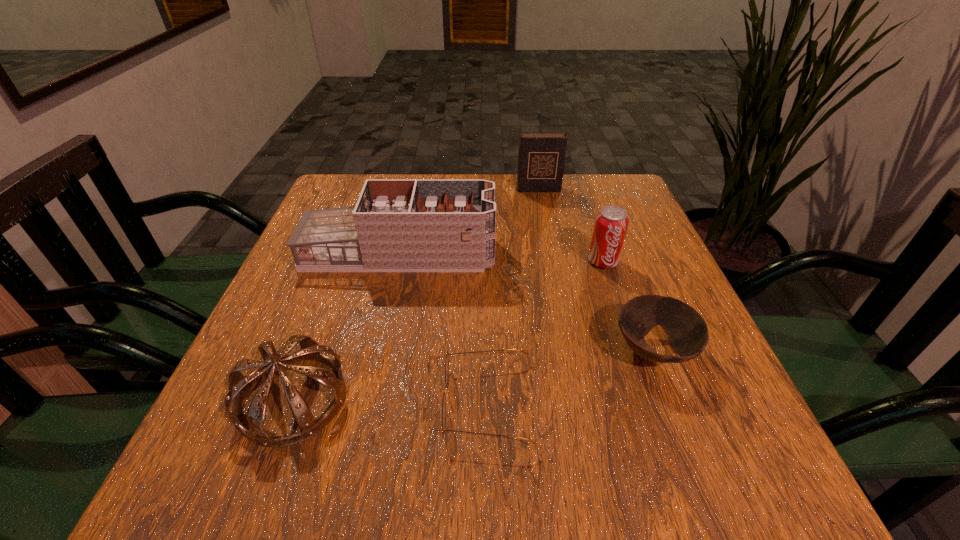
Image resolution: width=960 pixels, height=540 pixels. Identify the location of the third object from right to left. (541, 159).

Where is `the farthest object`? The image size is (960, 540). the farthest object is located at coordinates (541, 159).

Find the location of `dollhouse`. dollhouse is located at coordinates (405, 225).

At what (x,y) coordinates should I click in order to perform the action: click on soda can. Please return your answer as a coordinate pair (x, y). This screenshot has width=960, height=540. Looking at the image, I should click on (611, 223).

Locate an element on the screen. The height and width of the screenshot is (540, 960). tiara is located at coordinates (238, 384).

The height and width of the screenshot is (540, 960). In order to click on bowl in this screenshot , I will do `click(687, 331)`.

You are a GUI agent. You are given a task and a screenshot of the screen. Output one action in this format:
    pyautogui.click(x=<x>, y=<y>)
    Task: Click on the shortest object
    The height and width of the screenshot is (540, 960).
    Given the screenshot: What is the action you would take?
    pyautogui.click(x=446, y=368)

Locate an element on the screen. Image resolution: width=960 pixels, height=540 pixels. free space located on the front cover of the diary is located at coordinates click(x=540, y=202).

I want to click on vacant area situated at the entrance of the dollhouse, so click(628, 254).

Where is `blank space located on the logo side of the soda can`? blank space located on the logo side of the soda can is located at coordinates pos(635,355).